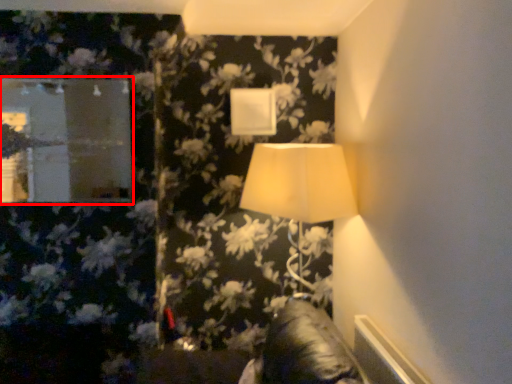
Question: From the image's perspective, where is mirror (annotated by the red box) located relative to lamp?

Choices:
 (A) above
 (B) below

Answer: (A)